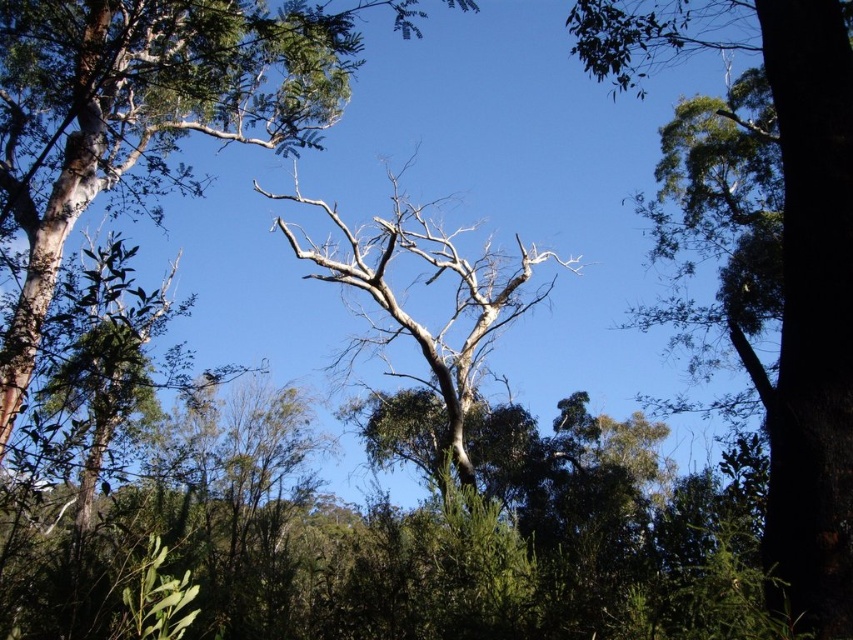
Can you confirm if smooth bark tree at center is positioned to the left of green leafy tree at upper right?

Indeed, smooth bark tree at center is positioned on the left side of green leafy tree at upper right.

Which is behind, point (125, 136) or point (788, 605)?

The point (125, 136) is behind.

The width and height of the screenshot is (853, 640). In order to click on smooth bark tree at center in this screenshot , I will do `click(148, 113)`.

Can you confirm if green leafy tree at upper right is taller than bare wood tree at center?

No.

Which is below, green leafy tree at upper right or bare wood tree at center?

green leafy tree at upper right is lower down.

Does point (808, 387) come in front of point (480, 305)?

Yes.

What are the coordinates of `green leafy tree at upper right` in the screenshot? It's located at (811, 312).

Consider the image. Which is more to the left, smooth bark tree at center or bare wood tree at center?

smooth bark tree at center

Between smooth bark tree at center and bare wood tree at center, which one is positioned higher?

smooth bark tree at center

Does point (6, 108) lie in front of point (309, 243)?

Yes, point (6, 108) is closer to viewer.

Find the location of a particular element. smooth bark tree at center is located at coordinates (148, 113).